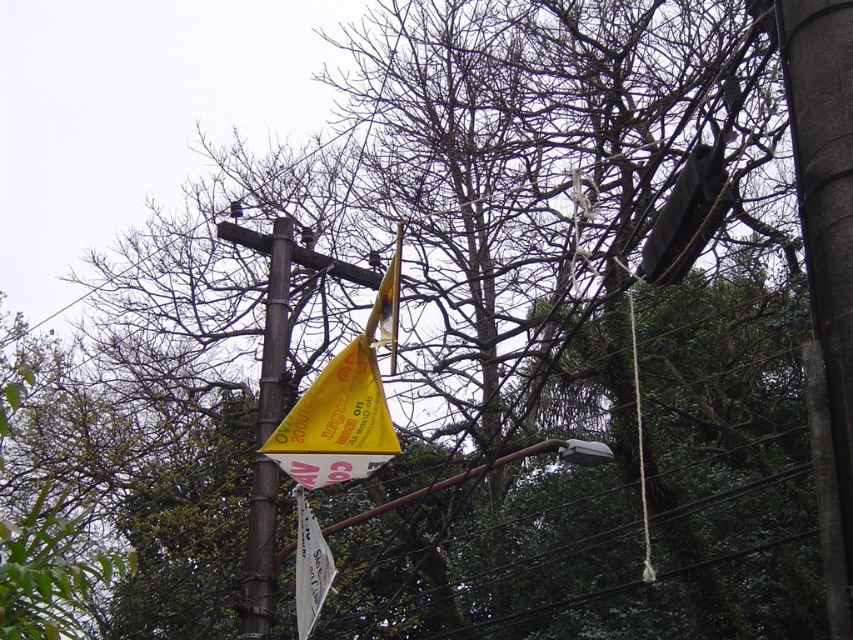
I want to click on yellow paper sign at upper left, so click(335, 422).

Which is behind, point (368, 364) or point (346, 528)?

Point (346, 528)

Identify the location of yellow paper sign at upper left. This screenshot has width=853, height=640. (335, 422).

Does point (300, 429) come behind point (331, 577)?

That is True.

Image resolution: width=853 pixels, height=640 pixels. In order to click on yellow paper sign at upper left in this screenshot , I will do `click(335, 422)`.

Between point (303, 477) and point (296, 488), which one is positioned behind?

Positioned behind is point (296, 488).

Locate an element on the screen. The height and width of the screenshot is (640, 853). yellow paper sign at upper left is located at coordinates (335, 422).

Can you confirm if rusty metal telegraph pole at center is positioned to the right of metallic gray streetlight at upper center?

Incorrect, rusty metal telegraph pole at center is not on the right side of metallic gray streetlight at upper center.

Is point (254, 492) behind point (573, 451)?

That is True.

Identify the location of rusty metal telegraph pole at center. The width and height of the screenshot is (853, 640). (259, 552).

Image resolution: width=853 pixels, height=640 pixels. I want to click on rusty metal telegraph pole at center, so click(x=259, y=552).